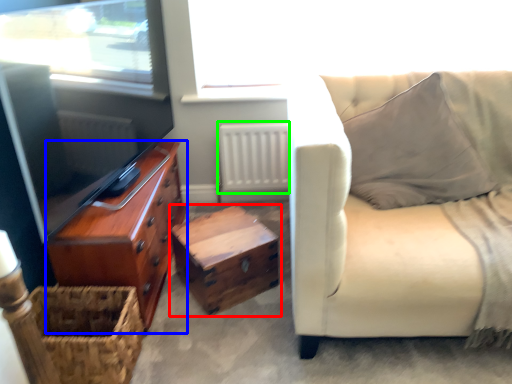
Question: Considering the real-world distances, which object is farthest from table (highlighted by a red box)? chest of drawers (highlighted by a blue box) or radiator (highlighted by a green box)?

Choices:
 (A) chest of drawers
 (B) radiator

Answer: (B)